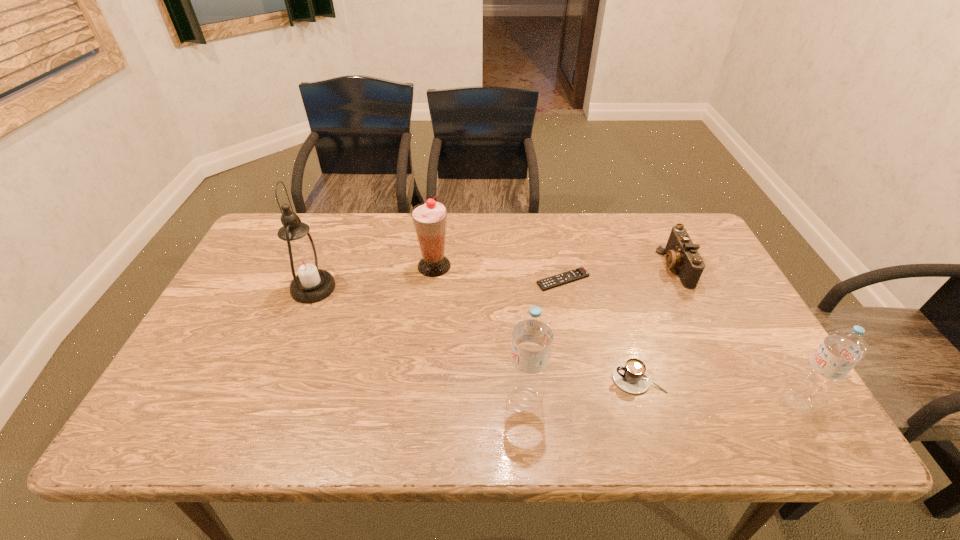
I want to click on the left water bottle, so click(533, 332).

Find the location of a particular element. Image resolution: width=960 pixels, height=540 pixels. the taller water bottle is located at coordinates (533, 332).

You are a GUI agent. You are given a task and a screenshot of the screen. Output one action in this format:
    pyautogui.click(x=<x>, y=<y>)
    Task: Click on the shorter water bottle
    The image size is (960, 540).
    Given the screenshot: What is the action you would take?
    pyautogui.click(x=841, y=349)

Locate an element on the screen. the rightmost object is located at coordinates (841, 349).

Identify the location of smoothie. (429, 218).

Find the location of `camera`. camera is located at coordinates (x=682, y=254).

Where is `the second object from right to left`? the second object from right to left is located at coordinates (682, 254).

Where is `the leftmost object`? This screenshot has height=540, width=960. the leftmost object is located at coordinates (303, 261).

I want to click on the shortest object, so click(x=554, y=281).

The height and width of the screenshot is (540, 960). In order to click on cappuccino in this screenshot , I will do `click(631, 376)`.